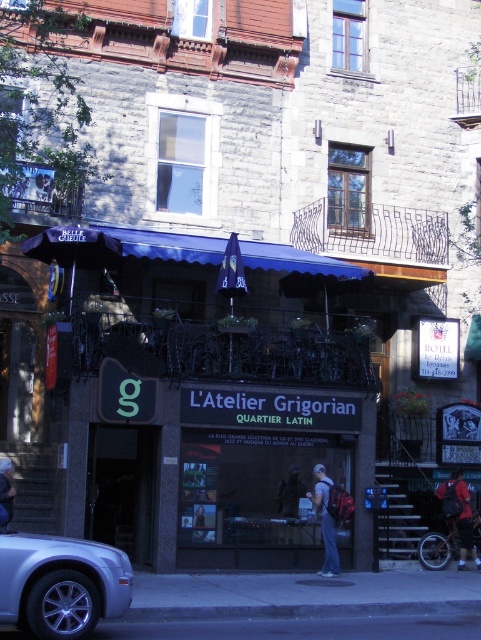
You are a customer at L Atelier Grigorian and you see two jackets hanging on the coat rack. The dark blue jacket at center and the denim jacket at lower right. Which jacket is bigger?

The denim jacket at lower right is bigger than the dark blue jacket at center.